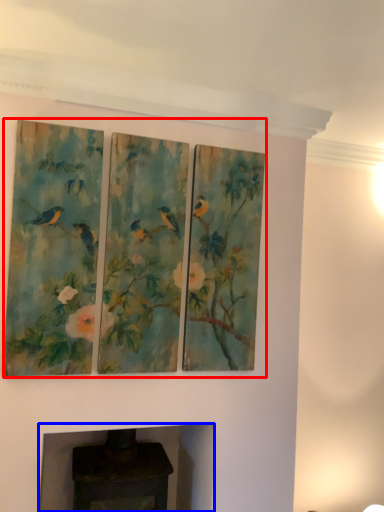
Question: Which object is further to the camera taking this photo, oil painting (highlighted by a red box) or fireplace (highlighted by a blue box)?

Choices:
 (A) oil painting
 (B) fireplace

Answer: (B)